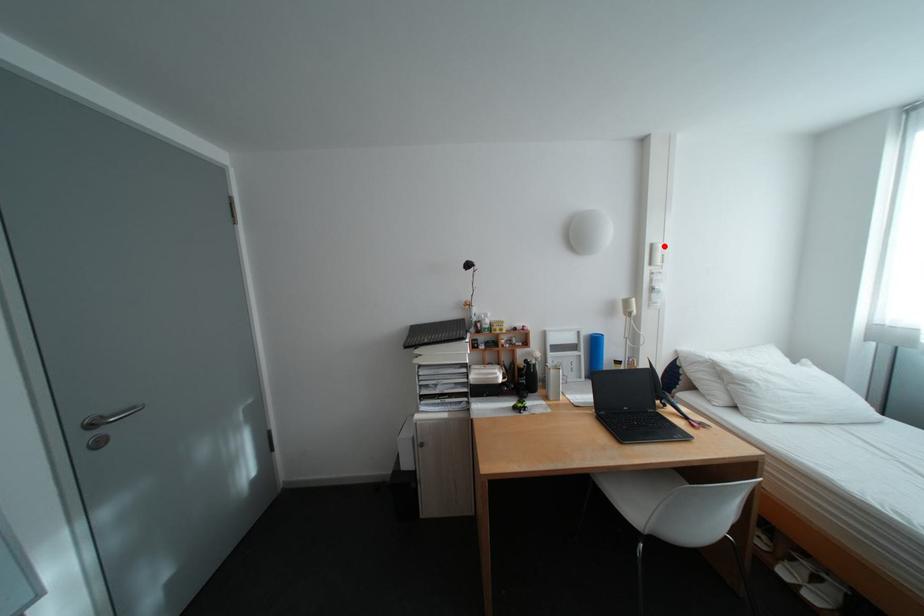
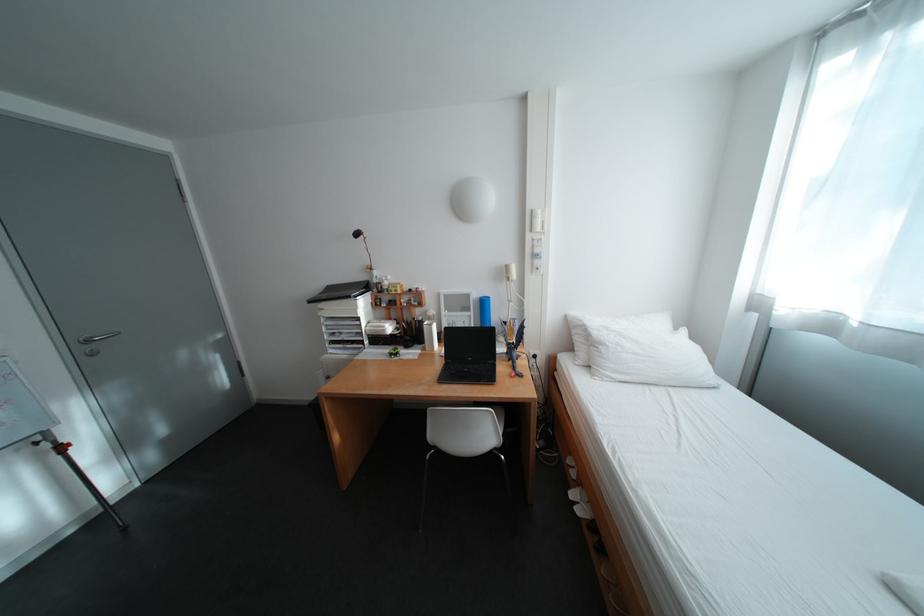
In the second image, find the point that corresponds to the highlighted location in the first image.

(544, 213)